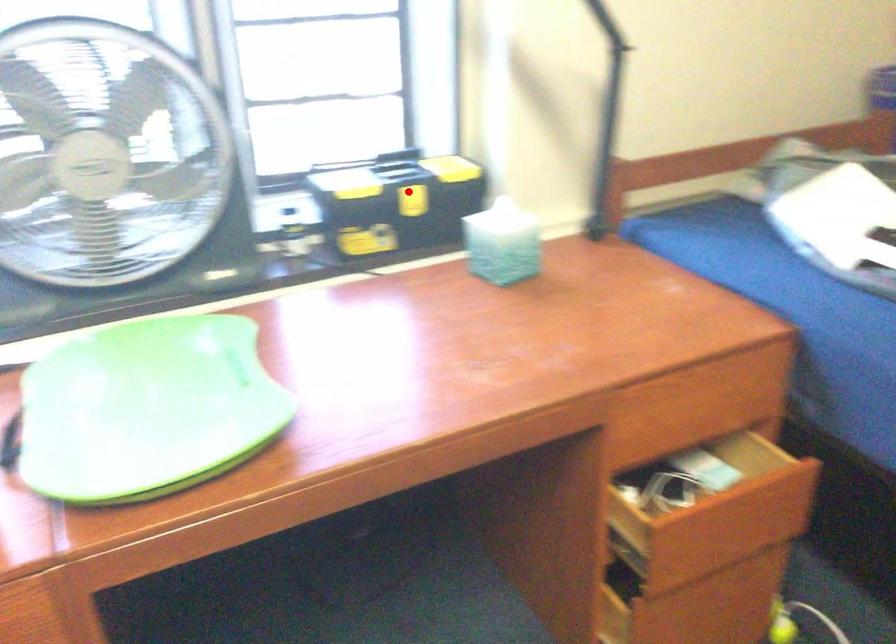
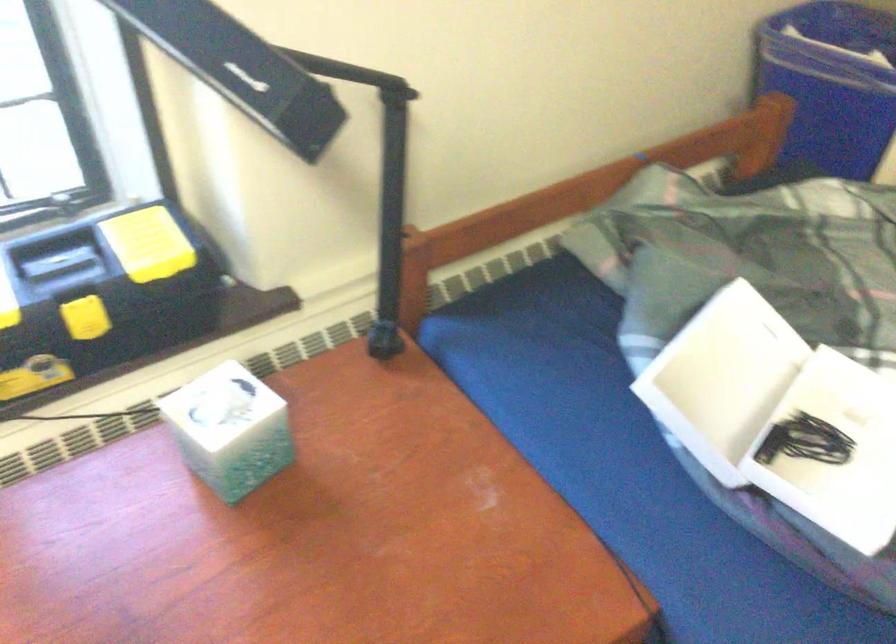
Question: I am providing you with two images of the same scene from different viewpoints. Image1 has a red point marked. In image2, the corresponding 3D location appears at what relative position? Reply with the corresponding letter.

Choices:
 (A) Closer
 (B) Farther

Answer: (A)